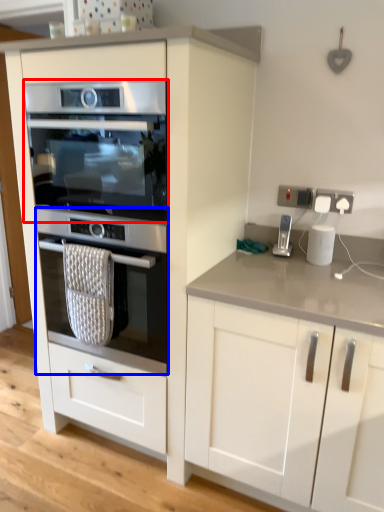
Question: Which object appears farthest to the camera in this image, oven (highlighted by a red box) or oven (highlighted by a blue box)?

Choices:
 (A) oven
 (B) oven

Answer: (B)